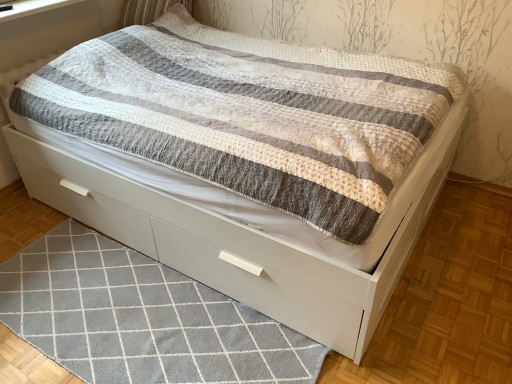
What is the approximate width of gray textured rug at lower center?

gray textured rug at lower center is 25.48 inches in width.

Locate an element on the screen. gray textured rug at lower center is located at coordinates (141, 318).

What do you see at coordinates (141, 318) in the screenshot? I see `gray textured rug at lower center` at bounding box center [141, 318].

I want to click on gray textured rug at lower center, so click(x=141, y=318).